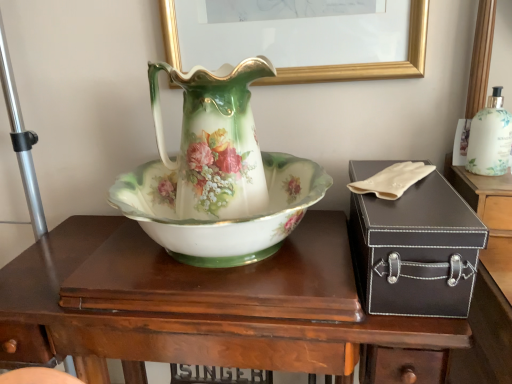
Question: Does white glossy bottle at upper right turn towards wooden desk at center?

Choices:
 (A) yes
 (B) no

Answer: (B)

Question: Is white glossy bottle at upper right further to the viewer compared to wooden desk at center?

Choices:
 (A) yes
 (B) no

Answer: (A)

Question: Considering the relative sizes of white glossy bottle at upper right and wooden desk at center in the image provided, is white glossy bottle at upper right thinner than wooden desk at center?

Choices:
 (A) yes
 (B) no

Answer: (A)

Question: Would you say white glossy bottle at upper right contains wooden desk at center?

Choices:
 (A) no
 (B) yes

Answer: (A)

Question: Can you confirm if white glossy bottle at upper right is shorter than wooden desk at center?

Choices:
 (A) yes
 (B) no

Answer: (A)

Question: Is white glossy bottle at upper right positioned in front of wooden desk at center?

Choices:
 (A) yes
 (B) no

Answer: (B)

Question: Does wooden desk at center have a lesser height compared to porcelain floral vase at center?

Choices:
 (A) yes
 (B) no

Answer: (B)

Question: From the image's perspective, is wooden desk at center located beneath porcelain floral vase at center?

Choices:
 (A) yes
 (B) no

Answer: (A)

Question: Is wooden desk at center placed right next to porcelain floral vase at center?

Choices:
 (A) no
 (B) yes

Answer: (A)

Question: Is wooden desk at center thinner than porcelain floral vase at center?

Choices:
 (A) yes
 (B) no

Answer: (B)

Question: Is wooden desk at center outside porcelain floral vase at center?

Choices:
 (A) yes
 (B) no

Answer: (A)

Question: Does wooden desk at center appear on the left side of porcelain floral vase at center?

Choices:
 (A) yes
 (B) no

Answer: (B)

Question: From a real-world perspective, does porcelain floral vase at center stand above white glossy bottle at upper right?

Choices:
 (A) yes
 (B) no

Answer: (A)